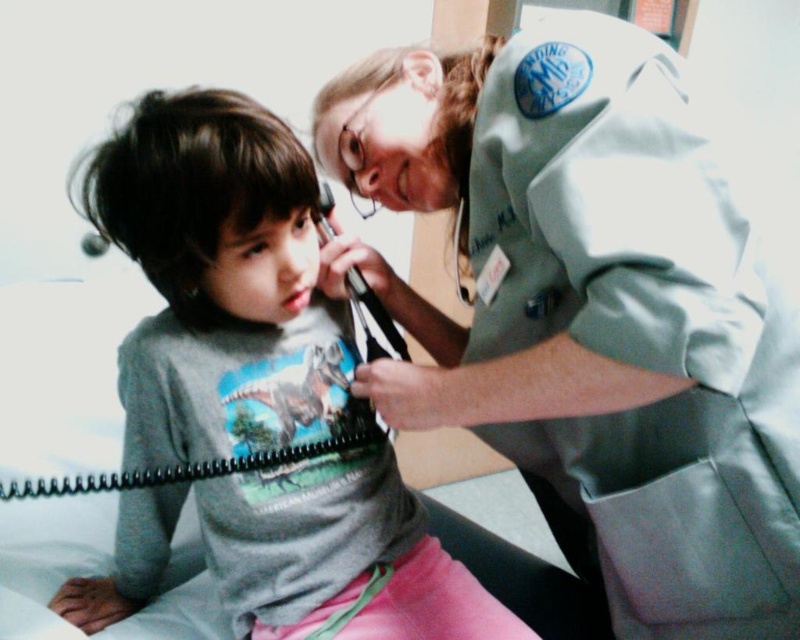
Between point (392, 180) and point (350, 371), which one is positioned behind?

Point (350, 371)

Who is shorter, gray smooth uniform at upper right or gray matte shirt at center?

gray matte shirt at center is shorter.

Describe the element at coordinates (594, 308) in the screenshot. I see `gray smooth uniform at upper right` at that location.

The image size is (800, 640). What are the coordinates of `gray smooth uniform at upper right` in the screenshot? It's located at (594, 308).